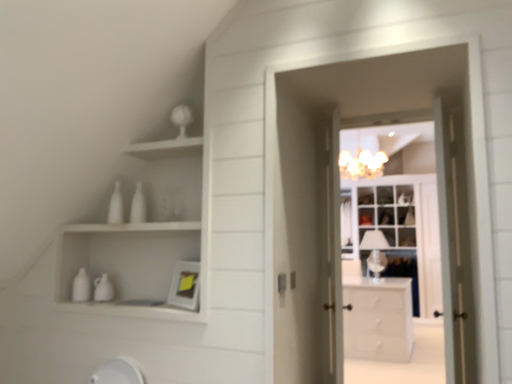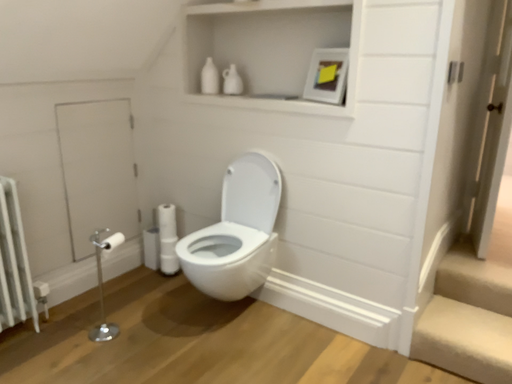
Question: How did the camera likely rotate when shooting the video?

Choices:
 (A) rotated left
 (B) rotated right

Answer: (A)